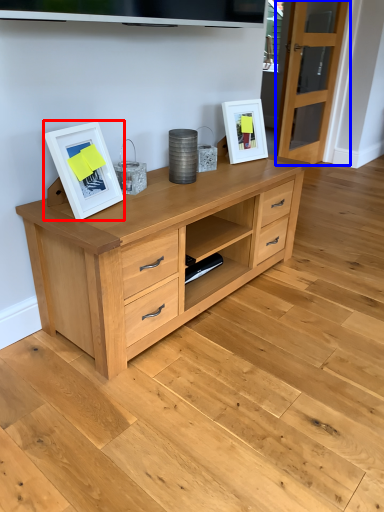
Question: Which point is closer to the camera, picture frame (highlighted by a red box) or glass door (highlighted by a blue box)?

Choices:
 (A) picture frame
 (B) glass door

Answer: (A)